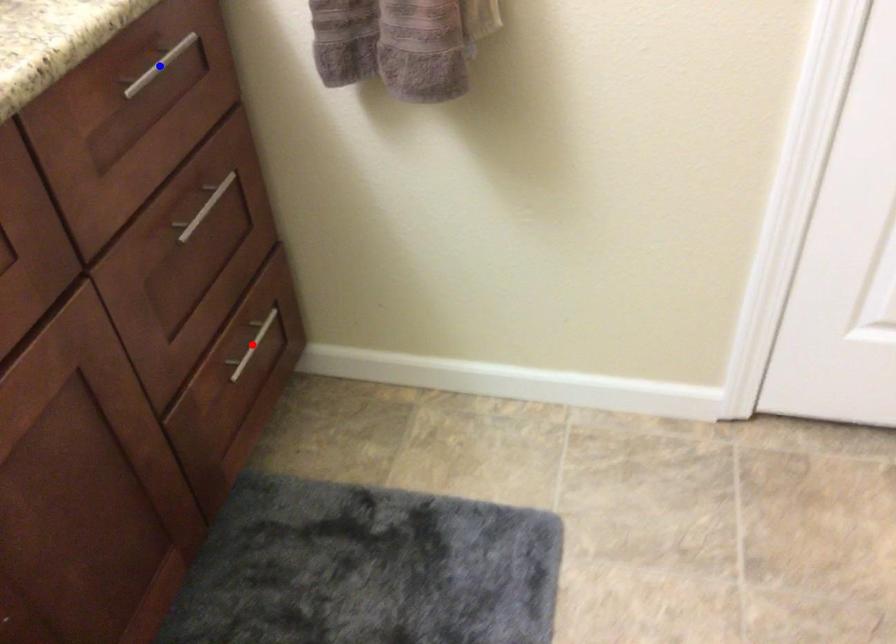
Question: Two points are marked on the image. Which point is closer to the camera?

Choices:
 (A) Blue point is closer.
 (B) Red point is closer.

Answer: (A)